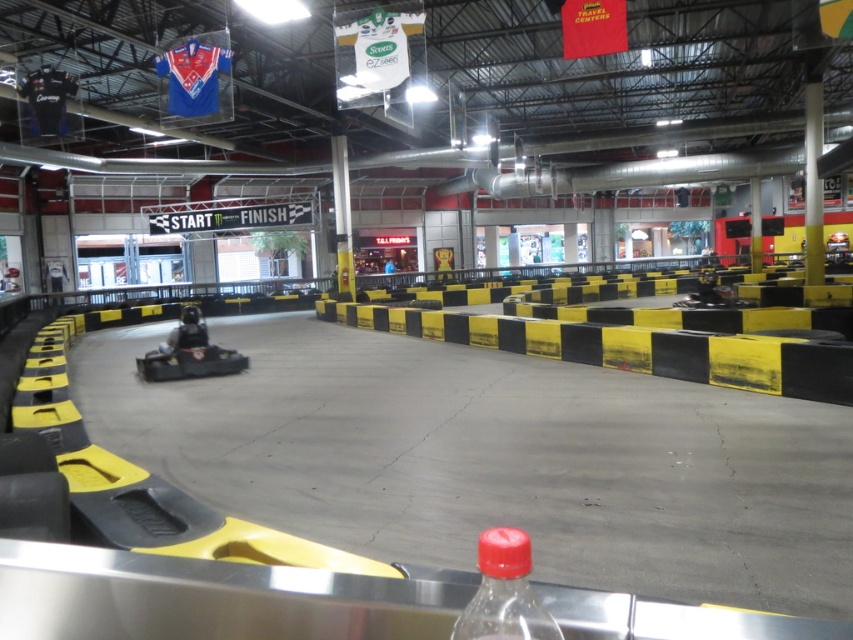
You are driving a go kart in the facility and need to navigate around the track. There are two points marked on your screen at coordinates point [780,387] and point [550,627]. Which point is located closer to the front of your go kart?

Point [550,627] is closer to the front of your go kart because it is in front of point [780,387], which is behind it.